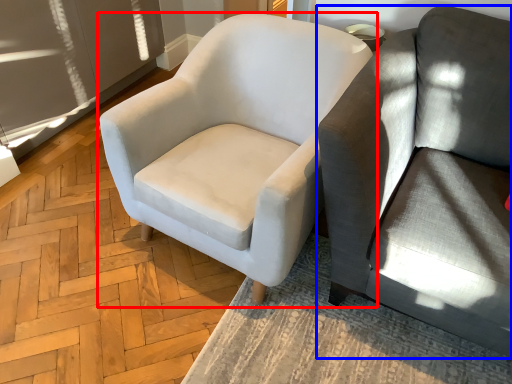
Question: Which of the following is the closest to the observer, chair (highlighted by a red box) or studio couch (highlighted by a blue box)?

Choices:
 (A) chair
 (B) studio couch

Answer: (B)